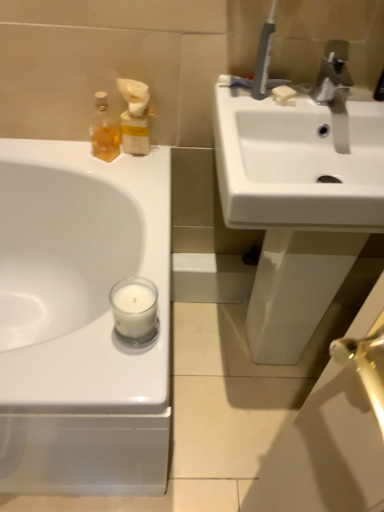
The image size is (384, 512). Find the location of `vacant area to the left of white matte soap at upper right`. vacant area to the left of white matte soap at upper right is located at coordinates click(250, 93).